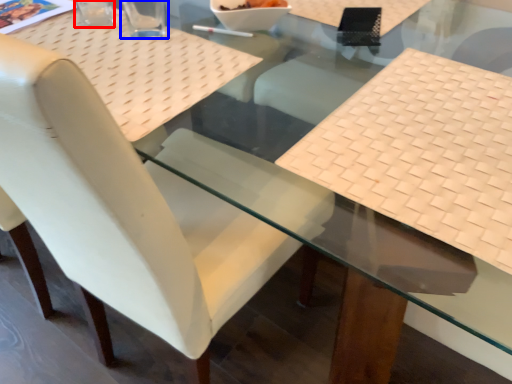
Question: Which point is further to the camera, clear (highlighted by a red box) or clear (highlighted by a blue box)?

Choices:
 (A) clear
 (B) clear

Answer: (A)